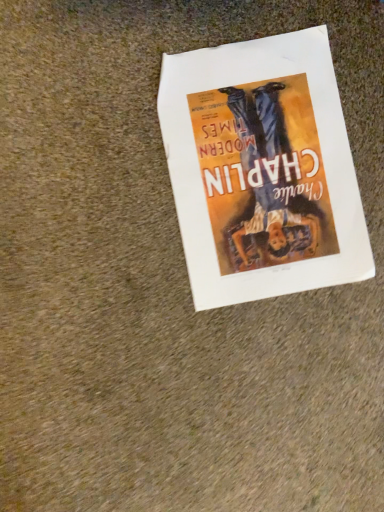
What do you see at coordinates (262, 169) in the screenshot?
I see `matte paper poster at center` at bounding box center [262, 169].

At what (x,y) coordinates should I click in order to perform the action: click on matte paper poster at center. Please return your answer as a coordinate pair (x, y). The image size is (384, 512). Looking at the image, I should click on click(x=262, y=169).

Locate an element on the screen. The width and height of the screenshot is (384, 512). matte paper poster at center is located at coordinates (262, 169).